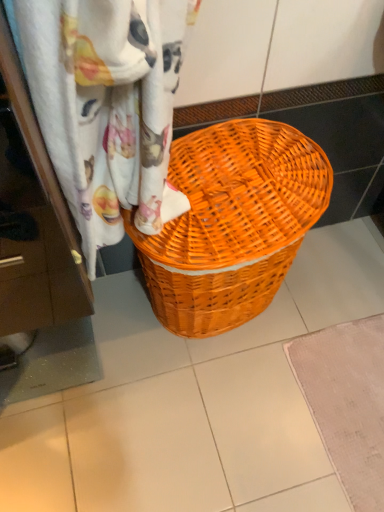
Question: Should I look upward or downward to see woven fabric curtain at upper center?

Choices:
 (A) down
 (B) up

Answer: (B)

Question: Could woven fabric curtain at upper center be considered to be inside orange wicker basket at center?

Choices:
 (A) no
 (B) yes

Answer: (A)

Question: From a real-world perspective, does orange wicker basket at center sit lower than woven fabric curtain at upper center?

Choices:
 (A) no
 (B) yes

Answer: (B)

Question: Is orange wicker basket at center in front of woven fabric curtain at upper center?

Choices:
 (A) yes
 (B) no

Answer: (B)

Question: Is orange wicker basket at center shorter than woven fabric curtain at upper center?

Choices:
 (A) yes
 (B) no

Answer: (B)

Question: From the image's perspective, is orange wicker basket at center beneath woven fabric curtain at upper center?

Choices:
 (A) no
 (B) yes

Answer: (B)

Question: Does orange wicker basket at center appear on the right side of woven fabric curtain at upper center?

Choices:
 (A) yes
 (B) no

Answer: (A)

Question: Would you say beige textured bath mat at lower right is outside orange wicker basket at center?

Choices:
 (A) yes
 (B) no

Answer: (A)

Question: From a real-world perspective, is beige textured bath mat at lower right located higher than orange wicker basket at center?

Choices:
 (A) yes
 (B) no

Answer: (B)

Question: Can you confirm if beige textured bath mat at lower right is positioned to the right of orange wicker basket at center?

Choices:
 (A) no
 (B) yes

Answer: (B)

Question: Considering the relative sizes of beige textured bath mat at lower right and orange wicker basket at center in the image provided, is beige textured bath mat at lower right taller than orange wicker basket at center?

Choices:
 (A) yes
 (B) no

Answer: (B)

Question: Considering the relative positions of beige textured bath mat at lower right and orange wicker basket at center in the image provided, is beige textured bath mat at lower right in front of orange wicker basket at center?

Choices:
 (A) yes
 (B) no

Answer: (B)

Question: Considering the relative positions of beige textured bath mat at lower right and orange wicker basket at center in the image provided, is beige textured bath mat at lower right to the left of orange wicker basket at center from the viewer's perspective?

Choices:
 (A) yes
 (B) no

Answer: (B)

Question: From the image's perspective, does woven fabric curtain at upper center appear lower than orange wicker basket at center?

Choices:
 (A) no
 (B) yes

Answer: (A)